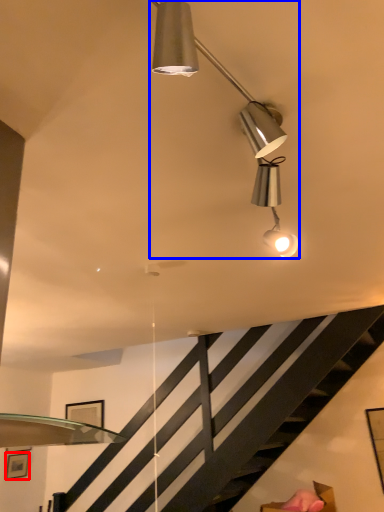
Question: Which point is further to the camera, picture frame (highlighted by a red box) or lamp (highlighted by a blue box)?

Choices:
 (A) picture frame
 (B) lamp

Answer: (A)